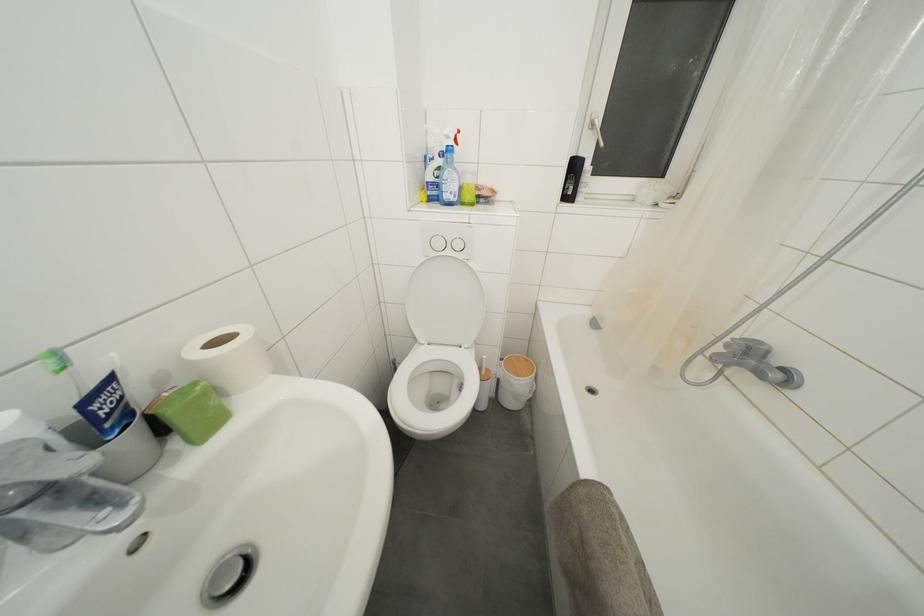
Where would you lift the toilet brush handle? Please return your answer as a coordinate pair (x, y).

(483, 369)